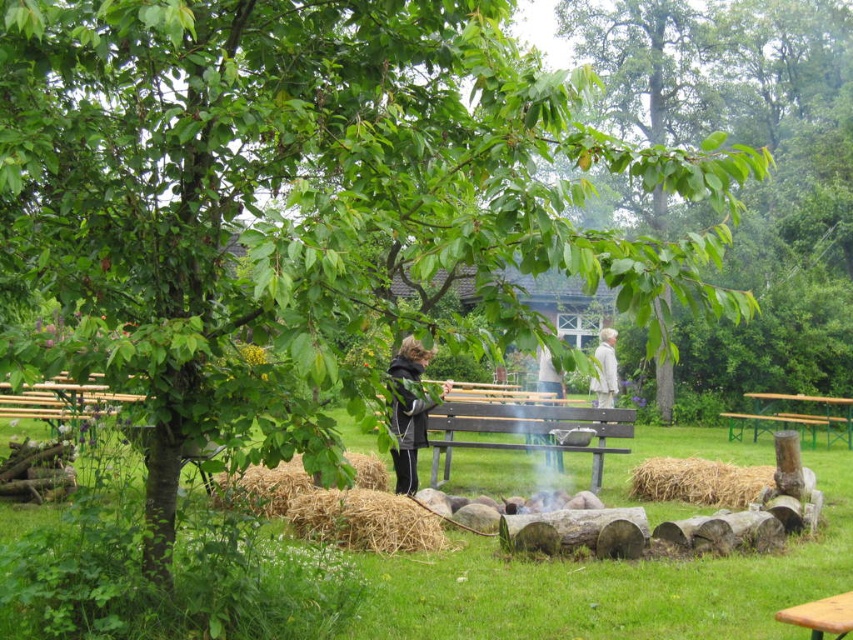
Question: Can you confirm if wooden bench at center is positioned to the right of white fabric coat at center?

Choices:
 (A) yes
 (B) no

Answer: (B)

Question: Does wooden bench at center appear under green painted wood picnic table at lower right?

Choices:
 (A) yes
 (B) no

Answer: (B)

Question: Does green leafy tree at upper center appear on the right side of dark gray fabric jacket at center?

Choices:
 (A) yes
 (B) no

Answer: (A)

Question: Which object is the closest to the green painted wood picnic table at lower right?

Choices:
 (A) green leafy tree at upper center
 (B) white fabric coat at center

Answer: (B)

Question: Estimate the real-world distances between objects in this image. Which object is farther from the green painted wood picnic table at lower right?

Choices:
 (A) green leafy tree at upper center
 (B) white fabric coat at center
 (C) dark gray fabric jacket at center
 (D) brown straw bale at center

Answer: (A)

Question: Which of the following is the closest to the observer?

Choices:
 (A) (811, 220)
 (B) (409, 476)
 (C) (604, 410)
 (D) (541, 365)

Answer: (B)